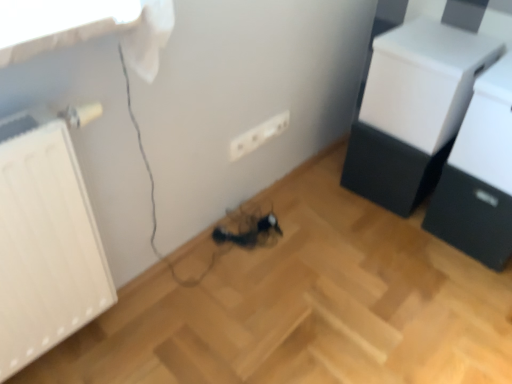
Question: From a real-world perspective, is black matte drawer at lower right physically located above or below white glossy printer at upper right, which appears as the 1th furniture when viewed from the right?

Choices:
 (A) below
 (B) above

Answer: (A)

Question: From the image's perspective, is black matte drawer at lower right above or below white glossy printer at upper right, which appears as the 1th furniture when viewed from the right?

Choices:
 (A) below
 (B) above

Answer: (A)

Question: Based on their relative distances, which object is nearer to the white glossy printer at upper right, which appears as the 1th furniture when viewed from the right?

Choices:
 (A) white matte radiator at left
 (B) white matte drawer at upper right, arranged as the first furniture when viewed from the left
 (C) white plastic electric outlet at center
 (D) black matte drawer at lower right

Answer: (D)

Question: Which of these objects is positioned farthest from the white matte drawer at upper right, the second furniture from the right?

Choices:
 (A) white glossy printer at upper right, placed as the 2th furniture when sorted from left to right
 (B) black matte drawer at lower right
 (C) white plastic electric outlet at center
 (D) white matte radiator at left

Answer: (D)